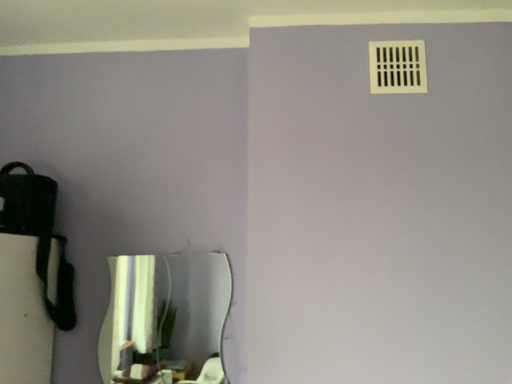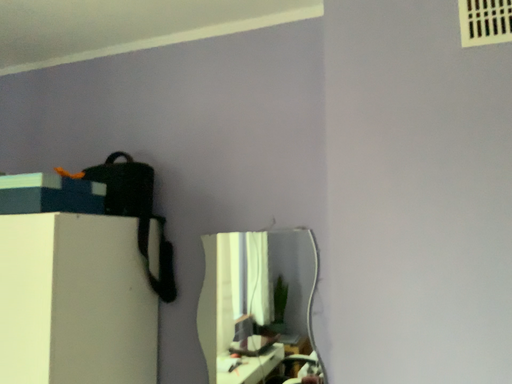
Question: Which way did the camera rotate in the video?

Choices:
 (A) rotated right
 (B) rotated left

Answer: (B)